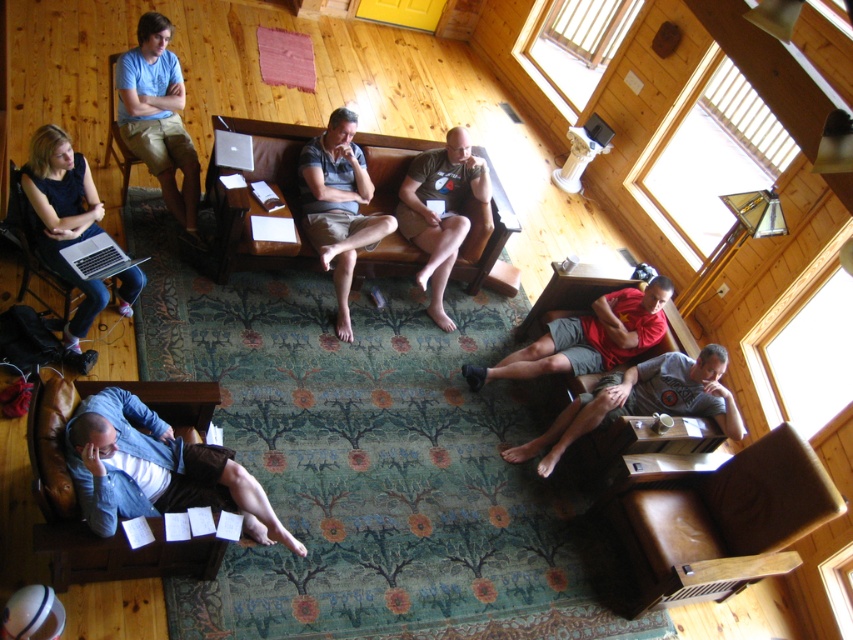
You are standing at the entrance of the cabin and want to move towards the point marked as point (84, 336). There is an obstacle at point (223, 275). Will you encounter this obstacle before reaching your destination?

Point (223, 275) is behind point (84, 336), so you will not encounter the obstacle at point (223, 275) before reaching your destination.

You are standing in the cabin and want to move from point A to point B. Point A is at coordinate point(683, 369) and point B is at coordinate point(138, 58). Which direction should you move to get from point A to point B?

You should move towards the lower left direction to get from point A to point B since point A is further to the viewer than point B.